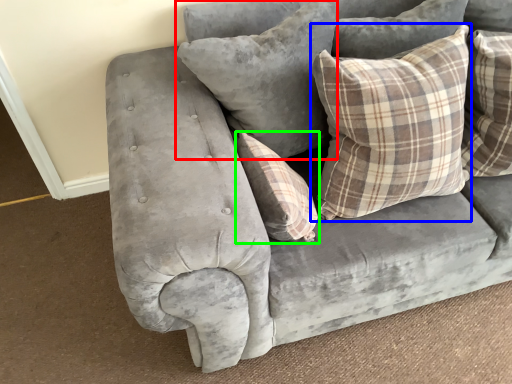
Question: Estimate the real-world distances between objects in this image. Which object is farther from pillow (highlighted by a red box), pillow (highlighted by a blue box) or pillow (highlighted by a green box)?

Choices:
 (A) pillow
 (B) pillow

Answer: (B)